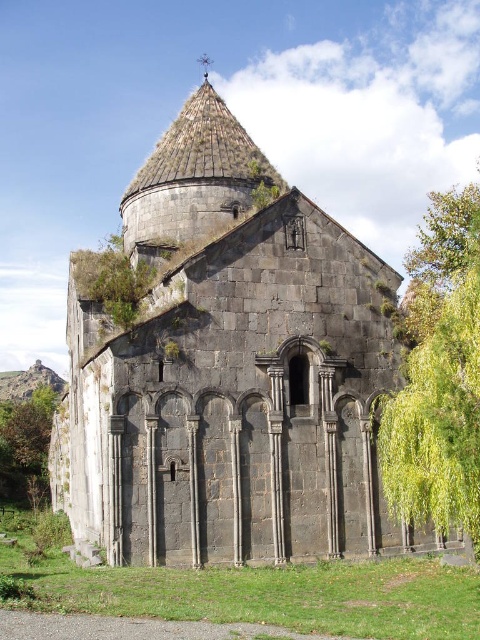
In the scene shown: You are standing in front of the dark gray stone church at center and the green leafy tree at right. Which object is taller?

The dark gray stone church at center is taller than the green leafy tree at right.

You are standing at the base of the green leafy tree at lower left and want to walk towards the dark gray stone church at center. Which direction should you move to reach it?

The dark gray stone church at center is located above the green leafy tree at lower left, so you should move upward to reach it.

You are standing in front of a historic stone structure. There is a point marked at coordinates (228, 369). What does this point represent?

The point at coordinates (228, 369) represents the dark gray stone church at center.